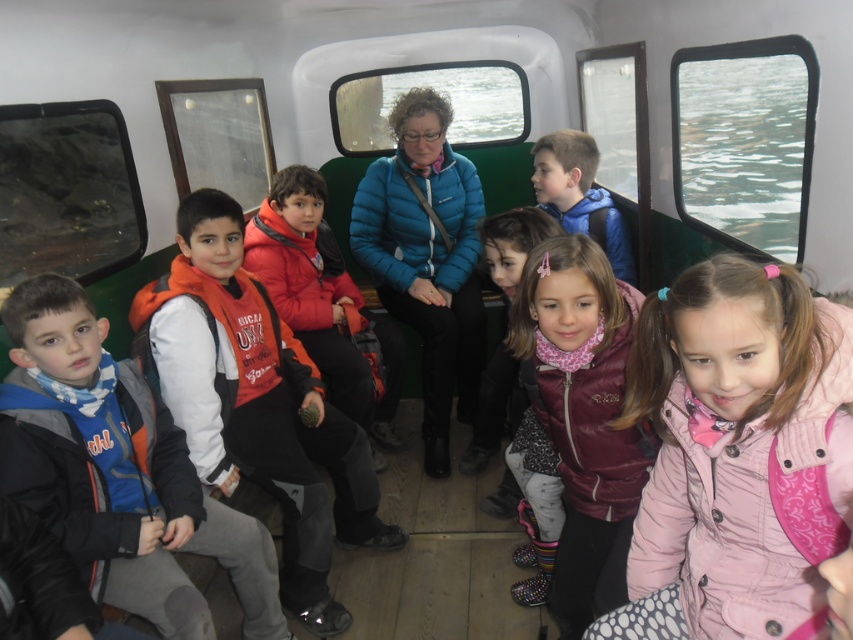
You are a photographer trying to capture a photo of the children in the boat. You notice the pink quilted jacket at lower right and the maroon fleece vest at center. Which child is sitting higher in the boat?

The pink quilted jacket at lower right is above the maroon fleece vest at center, so the child wearing the pink quilted jacket at lower right is sitting higher in the boat.

You are taking a photo of the scene and want to focus on both the point at coordinates point (753, 404) and point (567, 621). Which point should you adjust your camera focus on first to ensure it is sharp?

Point (753, 404) is closer to the camera than point (567, 621), so you should focus on point (753, 404) first to ensure it is sharp.